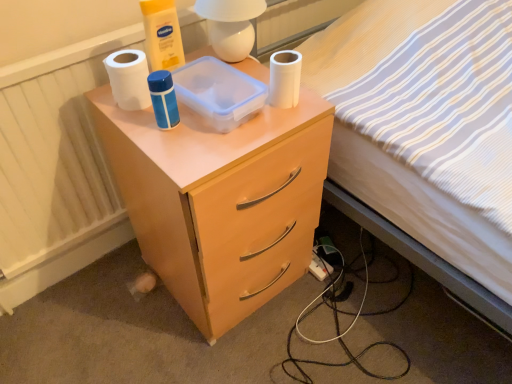
Describe the element at coordinates (319, 267) in the screenshot. I see `white plastic power outlet at lower right` at that location.

Locate an element on the screen. matte wood nightstand at center is located at coordinates pyautogui.click(x=221, y=201).

What do you see at coordinates (285, 78) in the screenshot? The image size is (512, 384). I see `white matte toilet paper at upper center, which appears as the 2th toilet paper when viewed from the left` at bounding box center [285, 78].

Find the location of a particular element. white glossy lamp at upper center is located at coordinates (231, 26).

Considering the relative sizes of white matte toilet paper at upper left, which is counted as the second toilet paper, starting from the right, and white glossy lamp at upper center in the image provided, is white matte toilet paper at upper left, which is counted as the second toilet paper, starting from the right, shorter than white glossy lamp at upper center?

Yes, white matte toilet paper at upper left, which is counted as the second toilet paper, starting from the right, is shorter than white glossy lamp at upper center.

Does white matte toilet paper at upper left, acting as the first toilet paper starting from the left, have a greater width compared to white glossy lamp at upper center?

Incorrect, the width of white matte toilet paper at upper left, acting as the first toilet paper starting from the left, does not surpass that of white glossy lamp at upper center.

Is white matte toilet paper at upper left, which is counted as the second toilet paper, starting from the right, bigger or smaller than white glossy lamp at upper center?

In the image, white matte toilet paper at upper left, which is counted as the second toilet paper, starting from the right, appears to be smaller than white glossy lamp at upper center.

Can white glossy lamp at upper center be found inside white matte toilet paper at upper left, acting as the first toilet paper starting from the left?

No, white matte toilet paper at upper left, acting as the first toilet paper starting from the left, does not contain white glossy lamp at upper center.

Does transparent plastic container at upper center turn towards white glossy lamp at upper center?

No, transparent plastic container at upper center is not turned towards white glossy lamp at upper center.

From a real-world perspective, is transparent plastic container at upper center below white glossy lamp at upper center?

Indeed, from a real-world perspective, transparent plastic container at upper center is positioned beneath white glossy lamp at upper center.

Which is closer to the camera, [224,108] or [227,35]?

Point [224,108] is positioned closer to the camera compared to point [227,35].

Is transparent plastic container at upper center thinner than white glossy lamp at upper center?

Incorrect, the width of transparent plastic container at upper center is not less than that of white glossy lamp at upper center.

Is white glossy lamp at upper center completely or partially inside white matte toilet paper at upper center, which appears as the 2th toilet paper when viewed from the left?

No, white glossy lamp at upper center is located outside of white matte toilet paper at upper center, which appears as the 2th toilet paper when viewed from the left.

From the image's perspective, is white matte toilet paper at upper center, which is counted as the first toilet paper, starting from the right, under white glossy lamp at upper center?

Indeed, from the image's perspective, white matte toilet paper at upper center, which is counted as the first toilet paper, starting from the right, is shown beneath white glossy lamp at upper center.

Is white matte toilet paper at upper center, which is counted as the first toilet paper, starting from the right, aimed at white glossy lamp at upper center?

No, white matte toilet paper at upper center, which is counted as the first toilet paper, starting from the right, is not turned towards white glossy lamp at upper center.

Considering the sizes of objects white glossy lamp at upper center and white matte toilet paper at upper left, acting as the first toilet paper starting from the left, in the image provided, who is smaller, white glossy lamp at upper center or white matte toilet paper at upper left, acting as the first toilet paper starting from the left,?

With smaller size is white matte toilet paper at upper left, acting as the first toilet paper starting from the left.

From a real-world perspective, is white glossy lamp at upper center above or below white matte toilet paper at upper left, which is counted as the second toilet paper, starting from the right?

In terms of real-world spatial position, white glossy lamp at upper center is above white matte toilet paper at upper left, which is counted as the second toilet paper, starting from the right.

Which object is positioned more to the right, white glossy lamp at upper center or white matte toilet paper at upper left, which is counted as the second toilet paper, starting from the right?

white glossy lamp at upper center is more to the right.

Is white glossy lamp at upper center oriented away from white matte toilet paper at upper left, acting as the first toilet paper starting from the left?

white glossy lamp at upper center is not turned away from white matte toilet paper at upper left, acting as the first toilet paper starting from the left.

From the image's perspective, is transparent plastic container at upper center below white plastic power outlet at lower right?

No, from the image's perspective, transparent plastic container at upper center is not beneath white plastic power outlet at lower right.

Is transparent plastic container at upper center positioned far away from white plastic power outlet at lower right?

No, there isn't a large distance between transparent plastic container at upper center and white plastic power outlet at lower right.

Looking at this image, is transparent plastic container at upper center oriented away from white plastic power outlet at lower right?

That's not correct — transparent plastic container at upper center is not looking away from white plastic power outlet at lower right.

Can you tell me how much transparent plastic container at upper center and white plastic power outlet at lower right differ in facing direction?

transparent plastic container at upper center and white plastic power outlet at lower right are facing 5.99 degrees away from each other.

From the image's perspective, is matte wood nightstand at center below white glossy lamp at upper center?

Yes, from the image's perspective, matte wood nightstand at center is below white glossy lamp at upper center.

Which object is thinner, matte wood nightstand at center or white glossy lamp at upper center?

white glossy lamp at upper center.

Based on the photo, from a real-world perspective, is matte wood nightstand at center on top of white glossy lamp at upper center?

No, from a real-world perspective, matte wood nightstand at center is not on top of white glossy lamp at upper center.

From a real-world perspective, which is physically below, white matte toilet paper at upper left, which is counted as the second toilet paper, starting from the right, or transparent plastic container at upper center?

transparent plastic container at upper center.

Between white matte toilet paper at upper left, which is counted as the second toilet paper, starting from the right, and transparent plastic container at upper center, which one is positioned behind?

white matte toilet paper at upper left, which is counted as the second toilet paper, starting from the right, is behind.

Is white matte toilet paper at upper left, acting as the first toilet paper starting from the left, aimed at transparent plastic container at upper center?

No, white matte toilet paper at upper left, acting as the first toilet paper starting from the left, is not facing towards transparent plastic container at upper center.

Image resolution: width=512 pixels, height=384 pixels. Find the location of `lamp above the white matte toilet paper at upper left, which is counted as the second toilet paper, starting from the right (from a real-world perspective)`. lamp above the white matte toilet paper at upper left, which is counted as the second toilet paper, starting from the right (from a real-world perspective) is located at coordinates (231, 26).

Locate an element on the screen. The width and height of the screenshot is (512, 384). lamp that appears behind the transparent plastic container at upper center is located at coordinates (231, 26).

Estimate the real-world distances between objects in this image. Which object is closer to white plastic power outlet at lower right, white striped fabric at upper right or transparent plastic container at upper center?

Based on the image, white striped fabric at upper right appears to be nearer to white plastic power outlet at lower right.

Considering their positions, is white striped fabric at upper right positioned further to white plastic power outlet at lower right than white glossy lamp at upper center?

white glossy lamp at upper center is further to white plastic power outlet at lower right.

Estimate the real-world distances between objects in this image. Which object is further from white matte toilet paper at upper left, which is counted as the second toilet paper, starting from the right, white matte toilet paper at upper center, which is counted as the first toilet paper, starting from the right, or matte wood nightstand at center?

matte wood nightstand at center is positioned further to the anchor white matte toilet paper at upper left, which is counted as the second toilet paper, starting from the right.

Considering their positions, is matte wood nightstand at center positioned closer to white matte toilet paper at upper center, which is counted as the first toilet paper, starting from the right, than white striped fabric at upper right?

Based on the image, matte wood nightstand at center appears to be nearer to white matte toilet paper at upper center, which is counted as the first toilet paper, starting from the right.

When comparing their distances from white matte toilet paper at upper center, which appears as the 2th toilet paper when viewed from the left, does white glossy lamp at upper center or white striped fabric at upper right seem further?

Based on the image, white striped fabric at upper right appears to be further to white matte toilet paper at upper center, which appears as the 2th toilet paper when viewed from the left.

Based on their spatial positions, is white striped fabric at upper right or white matte toilet paper at upper center, which appears as the 2th toilet paper when viewed from the left, further from white glossy lamp at upper center?

white striped fabric at upper right is positioned further to the anchor white glossy lamp at upper center.

Considering their positions, is white plastic power outlet at lower right positioned closer to white matte toilet paper at upper left, which is counted as the second toilet paper, starting from the right, than transparent plastic container at upper center?

transparent plastic container at upper center is positioned closer to the anchor white matte toilet paper at upper left, which is counted as the second toilet paper, starting from the right.

Looking at the image, which one is located further to white matte toilet paper at upper center, which is counted as the first toilet paper, starting from the right, transparent plastic container at upper center or white matte toilet paper at upper left, acting as the first toilet paper starting from the left?

Based on the image, white matte toilet paper at upper left, acting as the first toilet paper starting from the left, appears to be further to white matte toilet paper at upper center, which is counted as the first toilet paper, starting from the right.

In order to click on toilet paper situated between white matte toilet paper at upper left, which is counted as the second toilet paper, starting from the right, and white striped fabric at upper right from left to right in this screenshot , I will do `click(285, 78)`.

Identify the location of box between white matte toilet paper at upper center, which is counted as the first toilet paper, starting from the right, and matte wood nightstand at center from top to bottom. (x=219, y=92).

Find the location of `nightstand between white matte toilet paper at upper left, acting as the first toilet paper starting from the left, and white striped fabric at upper right`. nightstand between white matte toilet paper at upper left, acting as the first toilet paper starting from the left, and white striped fabric at upper right is located at coordinates (221, 201).

The image size is (512, 384). I want to click on lamp located between transparent plastic container at upper center and white striped fabric at upper right in the left-right direction, so [x=231, y=26].